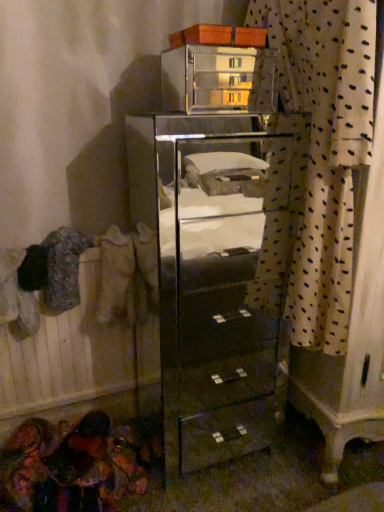
Question: From the image's perspective, is white dotted fabric at right above or below clear glass cabinet at center?

Choices:
 (A) below
 (B) above

Answer: (B)

Question: In terms of height, does white dotted fabric at right look taller or shorter compared to clear glass cabinet at center?

Choices:
 (A) short
 (B) tall

Answer: (A)

Question: Estimate the real-world distances between objects in this image. Which object is farther from the clear glass cabinet at upper center?

Choices:
 (A) clear glass cabinet at center
 (B) beige fabric at left
 (C) white dotted fabric at right

Answer: (B)

Question: Considering the real-world distances, which object is closest to the white dotted fabric at right?

Choices:
 (A) clear glass cabinet at center
 (B) clear glass cabinet at upper center
 (C) beige fabric at left

Answer: (C)